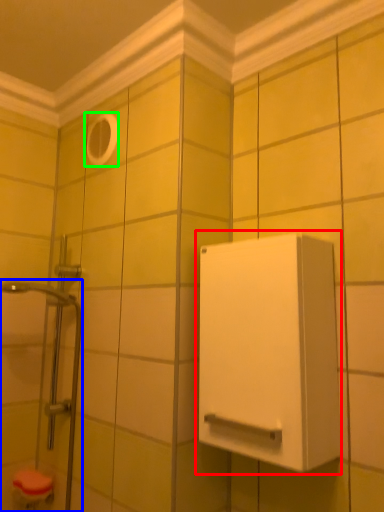
Question: Which object is positioned farthest from medicine cabinet (highlighted by a red box)? Select from shower door (highlighted by a blue box) and hole (highlighted by a green box).

Choices:
 (A) shower door
 (B) hole

Answer: (B)